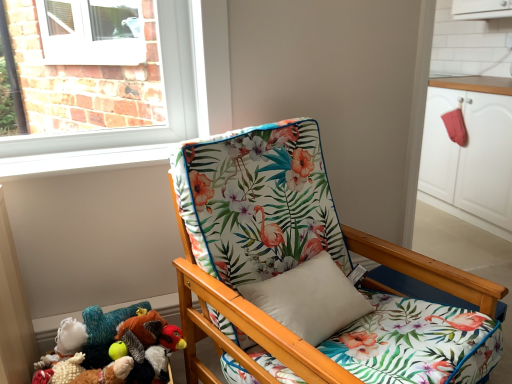
You are a GUI agent. You are given a task and a screenshot of the screen. Output one action in this format:
    pyautogui.click(x=<x>, y=<y>)
    Task: Click on the fluffy white stuffed animal at lower left, marked as the first toy in a left-to-right arrangement
    Image resolution: width=512 pixels, height=384 pixels.
    Given the screenshot: What is the action you would take?
    pyautogui.click(x=63, y=355)

Measure the distance between point (123, 382) and camera.

A distance of 1.34 meters exists between point (123, 382) and camera.

What do you see at coordinates (470, 151) in the screenshot?
I see `white matte cabinet at right` at bounding box center [470, 151].

Find the location of a particular element. The height and width of the screenshot is (384, 512). fluffy white stuffed animal at lower left, placed as the second toy when sorted from right to left is located at coordinates (63, 355).

From a real-world perspective, which object rests below the other?

fluffy white stuffed animal at lower left, placed as the second toy when sorted from right to left, from a real-world perspective.

Is fluffy white stuffed animal at lower left, marked as the first toy in a left-to-right arrangement, bigger or smaller than fluffy plush toy at lower left, marked as the 1th toy in a right-to-left arrangement?

In the image, fluffy white stuffed animal at lower left, marked as the first toy in a left-to-right arrangement, appears to be smaller than fluffy plush toy at lower left, marked as the 1th toy in a right-to-left arrangement.

Is fluffy white stuffed animal at lower left, placed as the second toy when sorted from right to left, aimed at fluffy plush toy at lower left, the 2th toy from the left?

Yes, fluffy white stuffed animal at lower left, placed as the second toy when sorted from right to left, faces towards fluffy plush toy at lower left, the 2th toy from the left.

Considering the points (59, 358) and (111, 365), which point is behind, point (59, 358) or point (111, 365)?

The point (59, 358) is farther from the camera.

Could you tell me if fluffy white stuffed animal at lower left, placed as the second toy when sorted from right to left, is turned towards floral fabric chair at center?

No, fluffy white stuffed animal at lower left, placed as the second toy when sorted from right to left, is not oriented towards floral fabric chair at center.

Which is in front, point (66, 358) or point (431, 377)?

The point (431, 377) is more forward.

Which object is more forward, fluffy white stuffed animal at lower left, placed as the second toy when sorted from right to left, or floral fabric chair at center?

floral fabric chair at center is in front.

Is white matte cabinet at right located outside fluffy white stuffed animal at lower left, marked as the first toy in a left-to-right arrangement?

Absolutely, white matte cabinet at right is external to fluffy white stuffed animal at lower left, marked as the first toy in a left-to-right arrangement.

Is white matte cabinet at right not close to fluffy white stuffed animal at lower left, marked as the first toy in a left-to-right arrangement?

Yes.

Who is smaller, white matte cabinet at right or fluffy white stuffed animal at lower left, placed as the second toy when sorted from right to left?

Smaller between the two is fluffy white stuffed animal at lower left, placed as the second toy when sorted from right to left.

Can you confirm if fluffy plush toy at lower left, the 2th toy from the left, is positioned to the right of floral fabric chair at center?

In fact, fluffy plush toy at lower left, the 2th toy from the left, is to the left of floral fabric chair at center.

Is fluffy plush toy at lower left, the 2th toy from the left, facing towards floral fabric chair at center?

No, fluffy plush toy at lower left, the 2th toy from the left, is not turned towards floral fabric chair at center.

From a real-world perspective, who is located higher, fluffy plush toy at lower left, the 2th toy from the left, or floral fabric chair at center?

floral fabric chair at center is physically above.

Where is `chair located above the fluffy plush toy at lower left, the 2th toy from the left (from a real-world perspective)`? This screenshot has height=384, width=512. chair located above the fluffy plush toy at lower left, the 2th toy from the left (from a real-world perspective) is located at coordinates (309, 264).

Is white matte cabinet at right facing towards floral fabric chair at center?

No, white matte cabinet at right is not facing towards floral fabric chair at center.

In the scene shown: Is white matte cabinet at right with floral fabric chair at center?

No, white matte cabinet at right is not in contact with floral fabric chair at center.

In the scene shown: Which of these two, white matte cabinet at right or floral fabric chair at center, stands shorter?

With less height is white matte cabinet at right.

Considering the points (471, 218) and (283, 375), which point is in front, point (471, 218) or point (283, 375)?

The point (283, 375) is closer to the camera.

Is fluffy plush toy at lower left, the 2th toy from the left, next to white matte cabinet at right?

fluffy plush toy at lower left, the 2th toy from the left, is not next to white matte cabinet at right, and they're not touching.

Is fluffy plush toy at lower left, the 2th toy from the left, spatially inside white matte cabinet at right, or outside of it?

fluffy plush toy at lower left, the 2th toy from the left, is not enclosed by white matte cabinet at right.

Is fluffy plush toy at lower left, marked as the 1th toy in a right-to-left arrangement, aimed at white matte cabinet at right?

No.

Is fluffy plush toy at lower left, marked as the 1th toy in a right-to-left arrangement, shorter than white matte cabinet at right?

Correct, fluffy plush toy at lower left, marked as the 1th toy in a right-to-left arrangement, is not as tall as white matte cabinet at right.

From a real-world perspective, is fluffy plush toy at lower left, marked as the 1th toy in a right-to-left arrangement, positioned above or below fluffy white stuffed animal at lower left, placed as the second toy when sorted from right to left?

fluffy plush toy at lower left, marked as the 1th toy in a right-to-left arrangement, is situated higher than fluffy white stuffed animal at lower left, placed as the second toy when sorted from right to left, in the real world.

Consider the image. Is fluffy plush toy at lower left, marked as the 1th toy in a right-to-left arrangement, not inside fluffy white stuffed animal at lower left, marked as the first toy in a left-to-right arrangement?

Absolutely, fluffy plush toy at lower left, marked as the 1th toy in a right-to-left arrangement, is external to fluffy white stuffed animal at lower left, marked as the first toy in a left-to-right arrangement.

Which is further, (91,379) or (66,351)?

The point (66,351) is behind.

Is fluffy plush toy at lower left, the 2th toy from the left, not close to fluffy white stuffed animal at lower left, placed as the second toy when sorted from right to left?

No, fluffy plush toy at lower left, the 2th toy from the left, is not far from fluffy white stuffed animal at lower left, placed as the second toy when sorted from right to left.

The image size is (512, 384). I want to click on toy above the fluffy white stuffed animal at lower left, marked as the first toy in a left-to-right arrangement (from a real-world perspective), so click(x=106, y=373).

Where is `chair above the fluffy white stuffed animal at lower left, placed as the second toy when sorted from right to left (from the image's perspective)`? The width and height of the screenshot is (512, 384). chair above the fluffy white stuffed animal at lower left, placed as the second toy when sorted from right to left (from the image's perspective) is located at coordinates (309, 264).

In the scene shown: From the image, which object appears to be farther from fluffy plush toy at lower left, marked as the 1th toy in a right-to-left arrangement, white matte cabinet at right or fluffy white stuffed animal at lower left, placed as the second toy when sorted from right to left?

Based on the image, white matte cabinet at right appears to be further to fluffy plush toy at lower left, marked as the 1th toy in a right-to-left arrangement.

When comparing their distances from floral fabric chair at center, does fluffy plush toy at lower left, marked as the 1th toy in a right-to-left arrangement, or fluffy white stuffed animal at lower left, placed as the second toy when sorted from right to left, seem further?

Based on the image, fluffy white stuffed animal at lower left, placed as the second toy when sorted from right to left, appears to be further to floral fabric chair at center.

Considering their positions, is white matte cabinet at right positioned further to fluffy white stuffed animal at lower left, placed as the second toy when sorted from right to left, than fluffy plush toy at lower left, marked as the 1th toy in a right-to-left arrangement?

white matte cabinet at right.

Looking at this image, which object lies further to the anchor point fluffy white stuffed animal at lower left, marked as the first toy in a left-to-right arrangement, fluffy plush toy at lower left, the 2th toy from the left, or white matte cabinet at right?

white matte cabinet at right is further to fluffy white stuffed animal at lower left, marked as the first toy in a left-to-right arrangement.

Which object lies further to the anchor point fluffy plush toy at lower left, marked as the 1th toy in a right-to-left arrangement, white matte cabinet at right or floral fabric chair at center?

Based on the image, white matte cabinet at right appears to be further to fluffy plush toy at lower left, marked as the 1th toy in a right-to-left arrangement.

Consider the image. When comparing their distances from floral fabric chair at center, does fluffy plush toy at lower left, marked as the 1th toy in a right-to-left arrangement, or white matte cabinet at right seem closer?

fluffy plush toy at lower left, marked as the 1th toy in a right-to-left arrangement, is positioned closer to the anchor floral fabric chair at center.

Estimate the real-world distances between objects in this image. Which object is further from floral fabric chair at center, white matte cabinet at right or fluffy white stuffed animal at lower left, marked as the first toy in a left-to-right arrangement?

white matte cabinet at right.

Based on their spatial positions, is fluffy white stuffed animal at lower left, placed as the second toy when sorted from right to left, or floral fabric chair at center closer to white matte cabinet at right?

The object closer to white matte cabinet at right is floral fabric chair at center.

At what (x,y) coordinates should I click in order to perform the action: click on toy situated between fluffy white stuffed animal at lower left, marked as the first toy in a left-to-right arrangement, and white matte cabinet at right from left to right. Please return your answer as a coordinate pair (x, y). The width and height of the screenshot is (512, 384). Looking at the image, I should click on (106, 373).

You are a GUI agent. You are given a task and a screenshot of the screen. Output one action in this format:
    pyautogui.click(x=<x>, y=<y>)
    Task: Click on the chair between fluffy white stuffed animal at lower left, marked as the first toy in a left-to-right arrangement, and white matte cabinet at right
    The image size is (512, 384).
    Given the screenshot: What is the action you would take?
    [x=309, y=264]

You are a GUI agent. You are given a task and a screenshot of the screen. Output one action in this format:
    pyautogui.click(x=<x>, y=<y>)
    Task: Click on the toy between fluffy white stuffed animal at lower left, placed as the second toy when sorted from right to left, and floral fabric chair at center
    The image size is (512, 384).
    Given the screenshot: What is the action you would take?
    pyautogui.click(x=106, y=373)

Find the location of a particular element. Image resolution: width=512 pixels, height=384 pixels. chair between fluffy plush toy at lower left, the 2th toy from the left, and white matte cabinet at right from left to right is located at coordinates (309, 264).